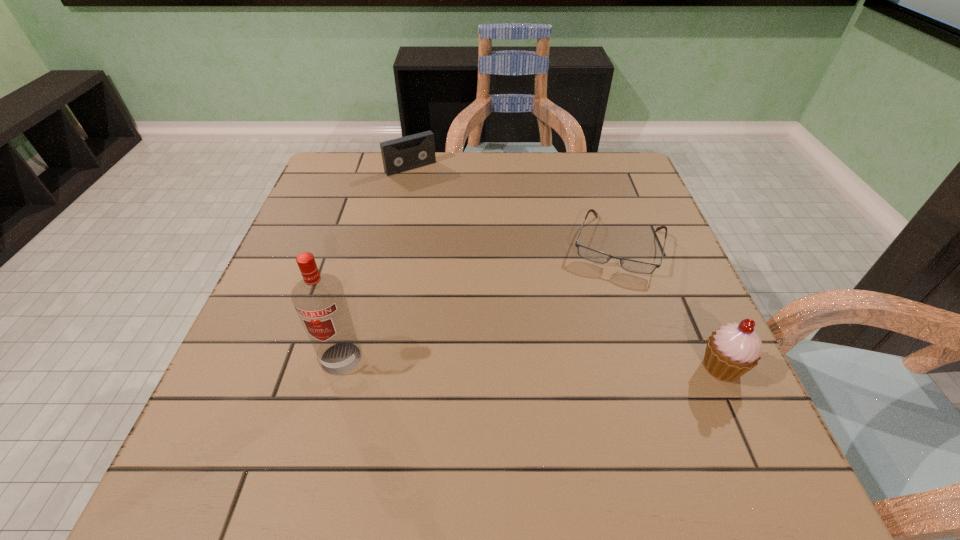
Identify the location of vacant spot on the desktop that is between the vodka and the cupcake and is positioned on the front-facing side of the shortest object. Image resolution: width=960 pixels, height=540 pixels. (582, 363).

Locate an element on the screen. The width and height of the screenshot is (960, 540). vacant spot on the desktop that is between the vodka and the cupcake and is positioned on the front-facing side of the videotape is located at coordinates (x=571, y=363).